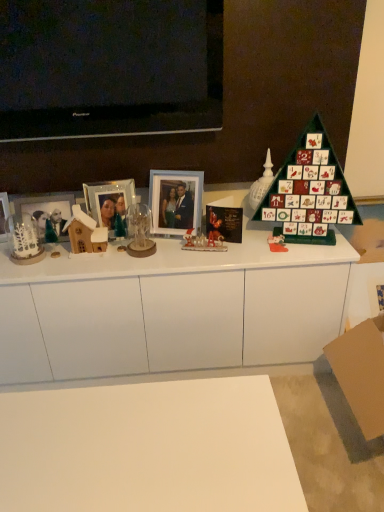
Locate an element on the screen. free space that is in between white glossy santa claus at center, marked as the fourth toy in a left-to-right arrangement, and matte plastic advent calendar at right, acting as the 6th toy starting from the left is located at coordinates (242, 246).